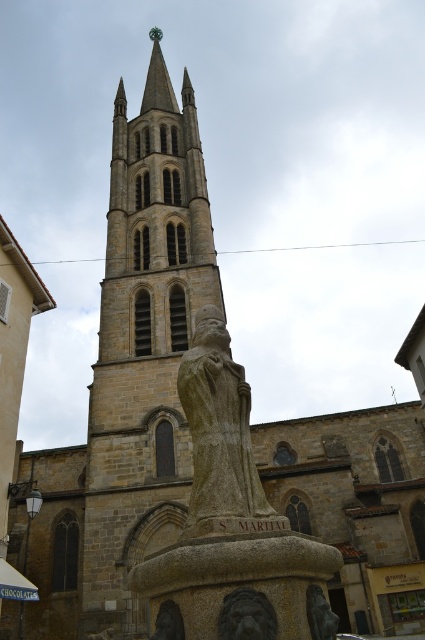
Does point (187, 371) lie in front of point (229, 593)?

No.

Is stone statue at center bigger than carved stone lion at center?

Indeed, stone statue at center has a larger size compared to carved stone lion at center.

Describe the element at coordinates (221, 436) in the screenshot. This screenshot has height=640, width=425. I see `stone statue at center` at that location.

Image resolution: width=425 pixels, height=640 pixels. What are the coordinates of `stone statue at center` in the screenshot? It's located at (221, 436).

Does gray stone statue at center appear on the right side of matte stone lion at lower center?

Correct, you'll find gray stone statue at center to the right of matte stone lion at lower center.

Which is above, gray stone statue at center or matte stone lion at lower center?

Positioned higher is gray stone statue at center.

Identify the location of gray stone statue at center. (320, 614).

Is stone statue at center thinner than gray stone statue at center?

No, stone statue at center is not thinner than gray stone statue at center.

Who is taller, stone statue at center or gray stone statue at center?

stone statue at center

Between point (204, 449) and point (325, 611), which one is positioned in front?

Point (325, 611)

Image resolution: width=425 pixels, height=640 pixels. In order to click on stone statue at center in this screenshot , I will do `click(221, 436)`.